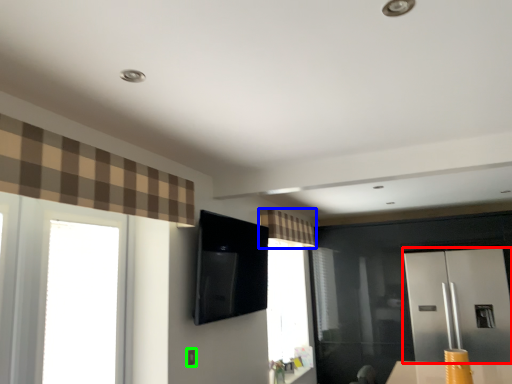
Question: Which object is the farthest from screen door (highlighted by a red box)? Choose among these: curtain (highlighted by a blue box) or electric outlet (highlighted by a green box).

Choices:
 (A) curtain
 (B) electric outlet

Answer: (B)